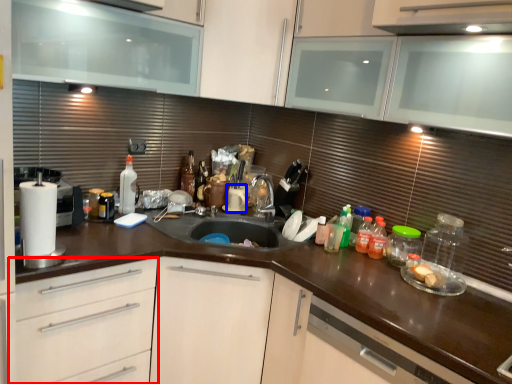
Question: Which object appears farthest to the camera in this image, drawer (highlighted by a red box) or appliance (highlighted by a blue box)?

Choices:
 (A) drawer
 (B) appliance

Answer: (B)